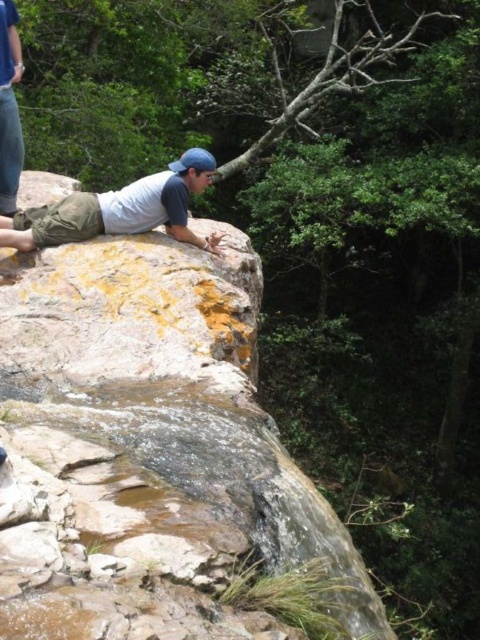
From the picture: You are a hiker who wants to place a small marker at the exact center of the cliff. The cliff is 10 meters wide. You see the point marked at (119, 209). Is this point located at the center of the cliff?

The point marked at (119, 209) is located at the center of the cliff, so yes, this is the correct location for placing the marker.

You are standing at the point labeled as point (45, 230) on the cliffside. You want to take a photo of the entire scene using a camera that has a maximum range of 5 meters. Can you capture the entire scene from your current position?

The distance between point (45, 230) and the camera is 5.53 meters, which exceeds the camera maximum range of 5 meters. Therefore, you cannot capture the entire scene from your current position.